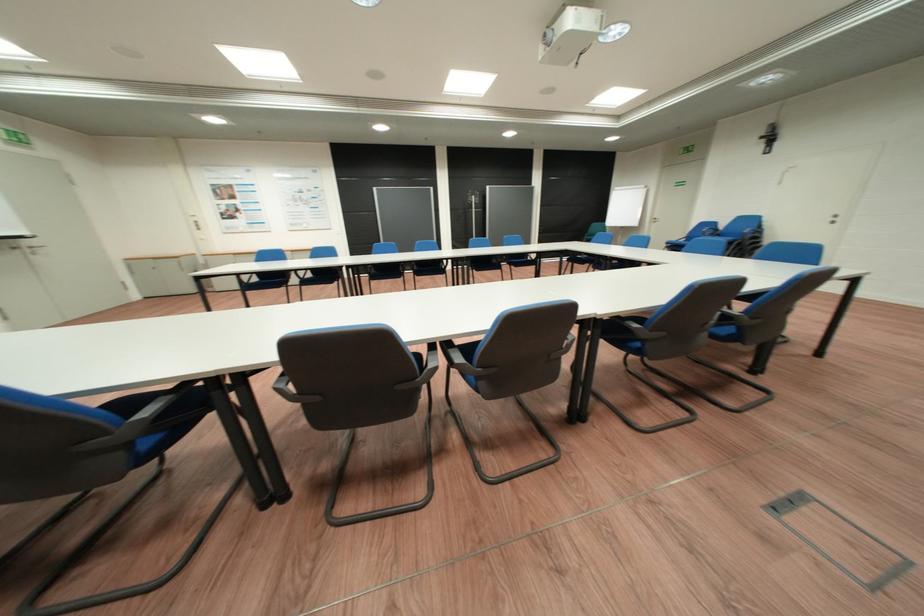
What do you see at coordinates (472, 211) in the screenshot? I see `a door push bar` at bounding box center [472, 211].